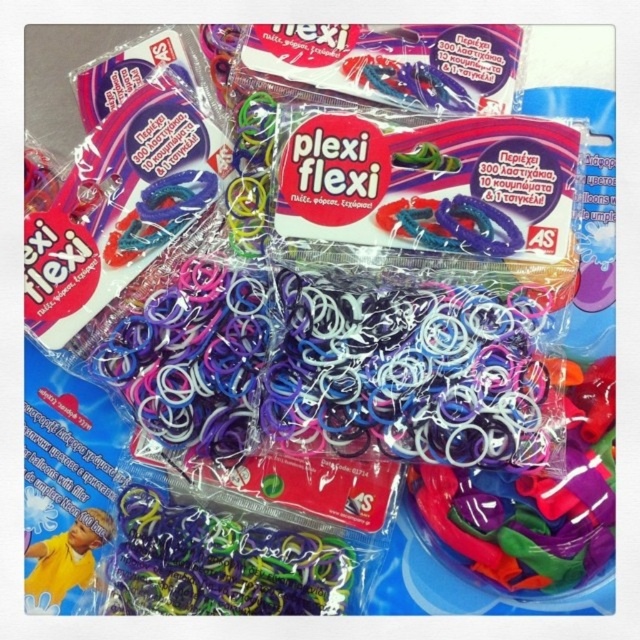
You are organizing a toy store shelf and see the multicolored rubber bands at center and the matte yellow toy at lower left. Which item is closer to you on the shelf?

The multicolored rubber bands at center are closer to you than the matte yellow toy at lower left because they are further to the viewer.

In the scene shown: You are a delivery person who needs to place a matte yellow toy at lower left on a shelf next to the translucent rubber bands at center. Given that the shelf is 30 inches wide, will the two items fit side by side?

The distance between the translucent rubber bands at center and the matte yellow toy at lower left is 31.70 inches. Since the shelf is only 30 inches wide, the two items will not fit side by side as they require more space than available.

In the scene shown: You have a small container that can only hold items narrower than the matte yellow toy at lower left. You want to store the multicolored rubber bands at center in it. Based on the image, will they fit?

The multicolored rubber bands at center might be wider than the matte yellow toy at lower left, so they may not fit in the container.